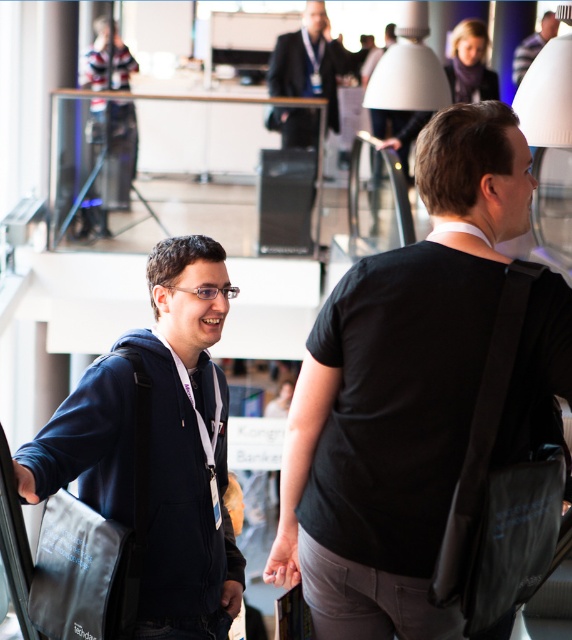
You are at a tech conference and need to locate your colleague who is wearing a dark blue hoodie at center and carrying a matte black backpack at upper right. From your current position, which item would you see first as you look towards them?

You would see the dark blue hoodie at center first because it is closer to you than the matte black backpack at upper right.

You are organizing a photo shoot and need to ensure that the dark blue hoodie at center and the matte black backpack at upper right are both visible in the frame. Given their sizes, which object should you prioritize positioning closer to the camera to maintain clarity?

The dark blue hoodie at center should be positioned closer to the camera because it is smaller than the matte black backpack at upper right, ensuring both are clearly visible in the frame.

You are organizing a luggage storage area at the event. You have a storage bin that can only accommodate items smaller than the dark suit at upper center. Can the black matte bag at center be placed in the bin?

The black matte bag at center is larger in size than the dark suit at upper center, so it cannot be placed in the storage bin.